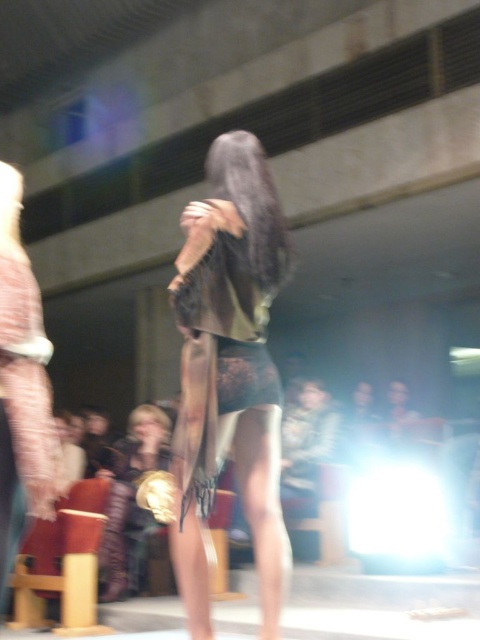
Question: Among these points, which one is nearest to the camera?

Choices:
 (A) (x=249, y=472)
 (B) (x=10, y=216)
 (C) (x=164, y=436)

Answer: (B)

Question: Is the position of shiny metallic dress at center more distant than that of satin black dress at center?

Choices:
 (A) no
 (B) yes

Answer: (B)

Question: Which point is farther to the camera?

Choices:
 (A) shiny gold dress at center
 (B) satin black dress at center
 (C) shiny metallic dress at center

Answer: (A)

Question: Can you confirm if satin black dress at center is positioned above shiny gold dress at center?

Choices:
 (A) no
 (B) yes

Answer: (B)

Question: Is satin black dress at center bigger than shiny gold dress at center?

Choices:
 (A) yes
 (B) no

Answer: (B)

Question: Which is nearer to the satin black dress at center?

Choices:
 (A) shiny metallic dress at center
 (B) shiny gold dress at center

Answer: (A)